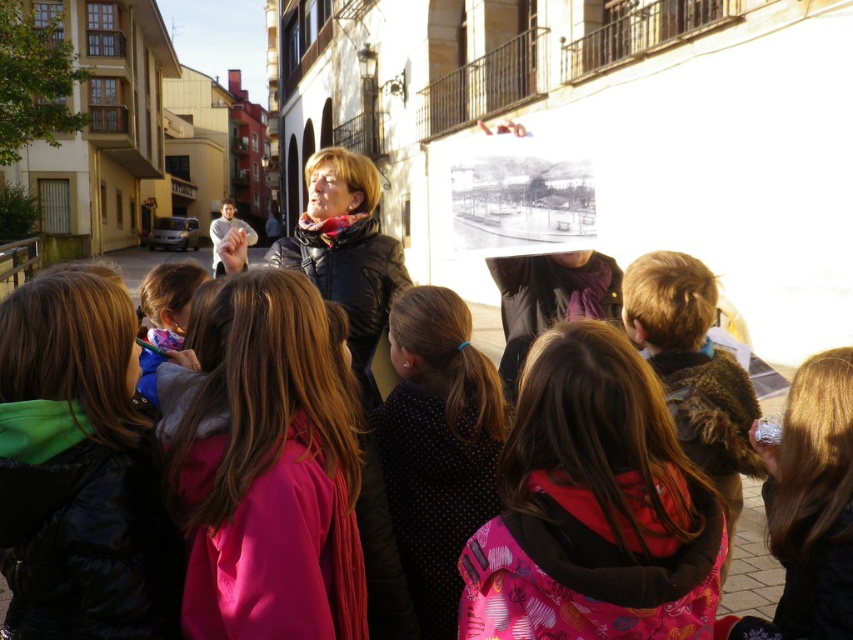
Can you confirm if brown fuzzy coat at right is smaller than blue fabric jacket at lower left?

No.

Find the location of `brown fuzzy coat at right`. brown fuzzy coat at right is located at coordinates (693, 369).

This screenshot has height=640, width=853. What do you see at coordinates (263, 467) in the screenshot? I see `pink fabric at center` at bounding box center [263, 467].

Is the position of pink fabric at center less distant than that of blue fabric jacket at lower left?

Yes, it is.

Where is `pink fabric at center`? The height and width of the screenshot is (640, 853). pink fabric at center is located at coordinates (263, 467).

Find the location of `pink fabric at center`. pink fabric at center is located at coordinates (263, 467).

Is point (80, 552) positioned before point (178, 291)?

Yes, it is.

Can you confirm if black puffy jacket at center is shorter than blue fabric jacket at lower left?

In fact, black puffy jacket at center may be taller than blue fabric jacket at lower left.

At what (x,y) coordinates should I click in order to perform the action: click on black puffy jacket at center. Please return your answer as a coordinate pair (x, y). This screenshot has width=853, height=640. Looking at the image, I should click on (78, 470).

At what (x,y) coordinates should I click in order to perform the action: click on black puffy jacket at center. Please return your answer as a coordinate pair (x, y). Looking at the image, I should click on click(78, 470).